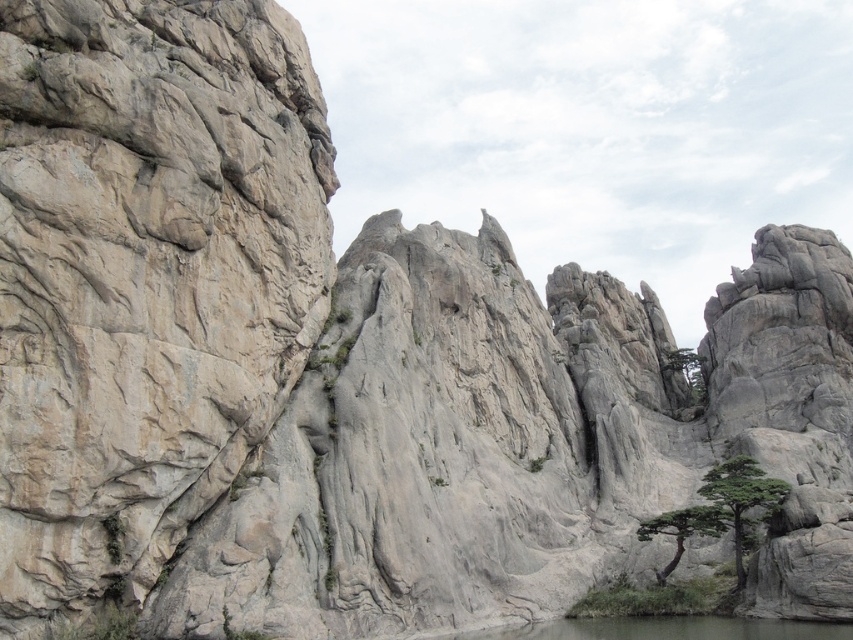
Question: Which is nearer to the green textured tree at lower right?

Choices:
 (A) green textured rock at lower right
 (B) clear water at lower center

Answer: (A)

Question: Which point is farther to the camera?

Choices:
 (A) green textured tree at lower right
 (B) green textured rock at lower right
 (C) clear water at lower center

Answer: (A)

Question: Does green textured rock at lower right appear under green textured tree at lower right?

Choices:
 (A) yes
 (B) no

Answer: (B)

Question: Is clear water at lower center thinner than green textured rock at lower right?

Choices:
 (A) no
 (B) yes

Answer: (A)

Question: Which point is farther to the camera?

Choices:
 (A) (761, 504)
 (B) (509, 628)
 (C) (645, 538)

Answer: (C)

Question: Is clear water at lower center thinner than green textured rock at lower right?

Choices:
 (A) yes
 (B) no

Answer: (B)